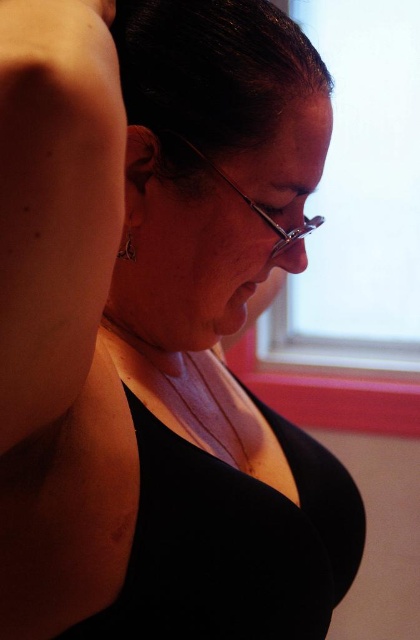
Between point (257, 518) and point (136, 109), which one is positioned behind?

Point (257, 518)

From the picture: Is black matte tank top at center taller than dark shiny hair at upper center?

Correct, black matte tank top at center is much taller as dark shiny hair at upper center.

Does point (352, 500) come behind point (280, 36)?

Yes, it is.

Locate an element on the screen. This screenshot has height=640, width=420. black matte tank top at center is located at coordinates (218, 328).

Does black matte dress at center appear on the right side of silver metallic earring at upper left?

Yes, black matte dress at center is to the right of silver metallic earring at upper left.

Does point (226, 598) come behind point (126, 225)?

No, (226, 598) is closer to viewer.

I want to click on black matte dress at center, so click(233, 541).

Who is higher up, black matte tank top at center or silver metallic earring at upper left?

silver metallic earring at upper left is higher up.

Can you confirm if black matte tank top at center is bigger than silver metallic earring at upper left?

Yes.

Measure the distance between black matte tank top at center and camera.

black matte tank top at center is 20.27 inches away from camera.

Where is `black matte tank top at center`? This screenshot has width=420, height=640. black matte tank top at center is located at coordinates [x=218, y=328].